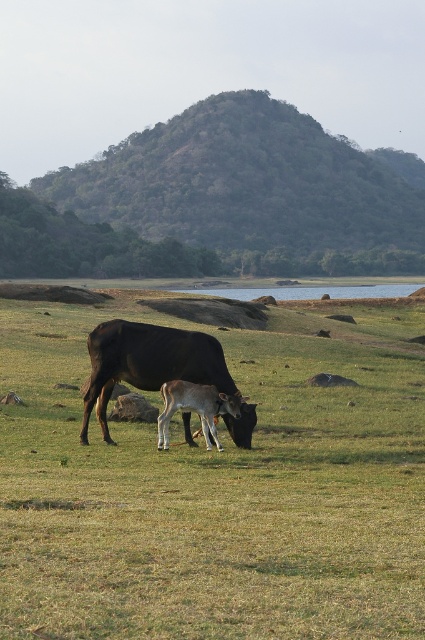
You are a farmer checking the field. You see the green grassy field at center and the white smooth calf at center. Which one is higher up in the image?

The green grassy field at center is located above the white smooth calf at center, so the green grassy field at center is higher up in the image.

You are a farmer checking the field. You notice the green grassy field at center and the shiny black cow at center. Which one is taller?

The green grassy field at center is much taller as shiny black cow at center.